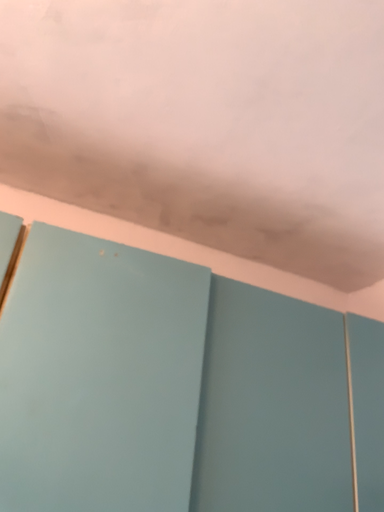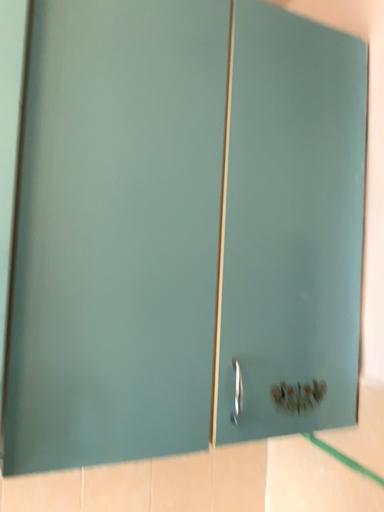
Question: How did the camera likely rotate when shooting the video?

Choices:
 (A) rotated downward
 (B) rotated upward

Answer: (A)